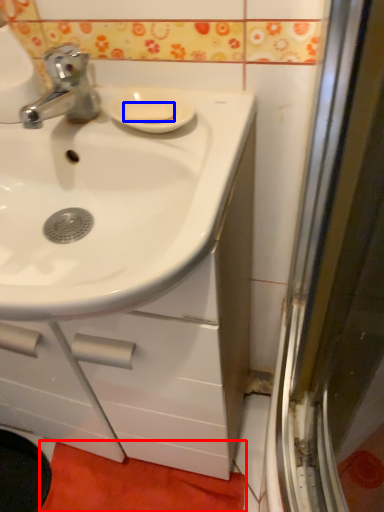
Question: Which object appears farthest to the camera in this image, bath mat (highlighted by a red box) or soap (highlighted by a blue box)?

Choices:
 (A) bath mat
 (B) soap

Answer: (A)